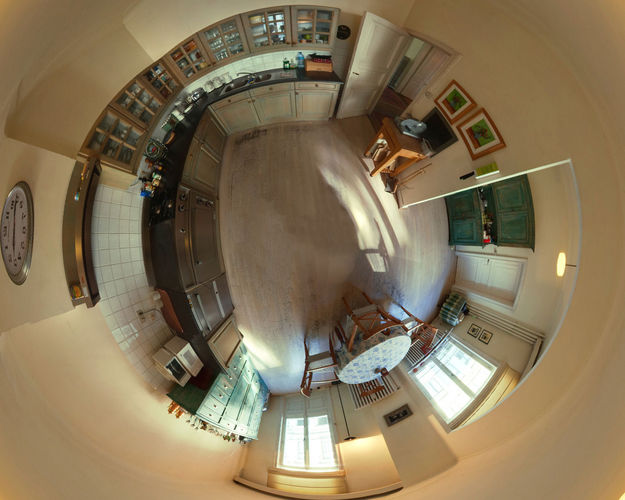
At what (x,y) coordinates should I click in order to perform the action: click on table. Please return your answer as a coordinate pair (x, y). This screenshot has width=625, height=500. Looking at the image, I should click on (374, 358).